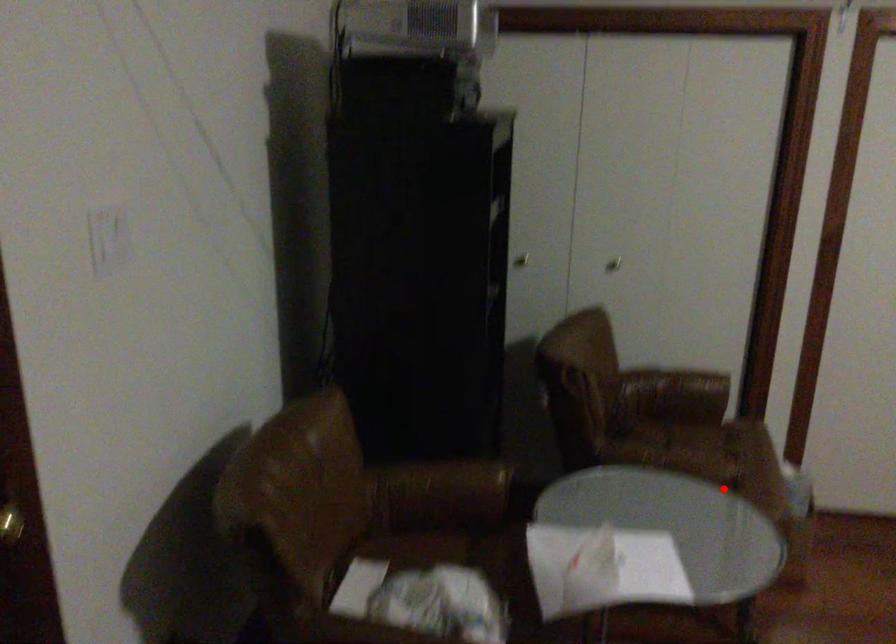
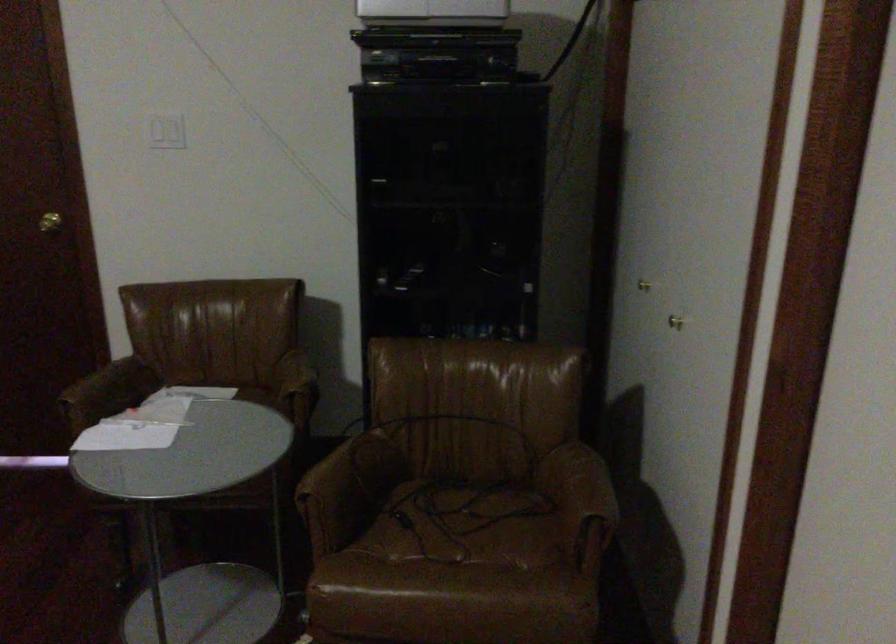
Question: I am providing you with two images of the same scene from different viewpoints. A red point is marked on the first image. At the location where the point appears in image 1, is it still visible in image 2?

Choices:
 (A) Yes
 (B) No

Answer: (A)